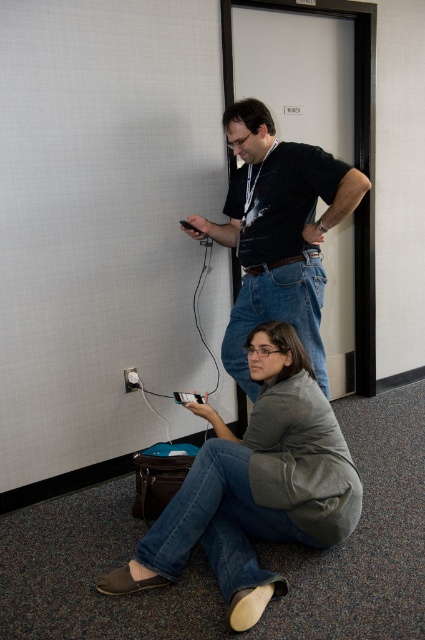
Question: Can you confirm if gray cotton shirt at lower center is positioned below black matte shirt at center?

Choices:
 (A) yes
 (B) no

Answer: (A)

Question: Which point appears farthest from the camera in this image?

Choices:
 (A) (136, 369)
 (B) (241, 218)
 (C) (243, 452)

Answer: (A)

Question: Can you confirm if black matte shirt at center is positioned to the left of white plastic plug at lower left?

Choices:
 (A) no
 (B) yes

Answer: (A)

Question: Which point is farther to the camera?

Choices:
 (A) (129, 381)
 (B) (249, 173)

Answer: (A)

Question: Based on their relative distances, which object is nearer to the white plastic plug at lower left?

Choices:
 (A) black matte shirt at center
 (B) gray cotton shirt at lower center

Answer: (A)

Question: Does gray cotton shirt at lower center appear on the left side of white plastic plug at lower left?

Choices:
 (A) no
 (B) yes

Answer: (A)